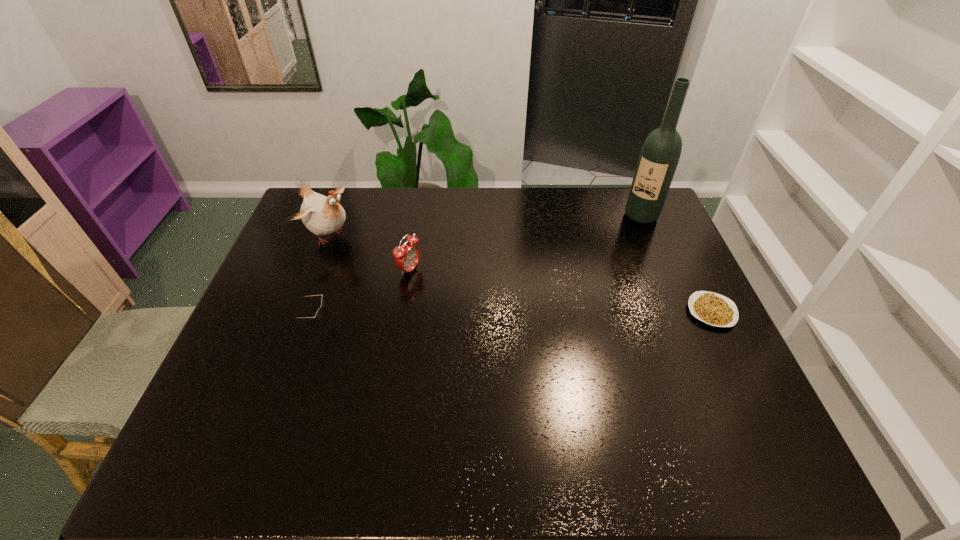
Find the location of `free space between the tallest object and the bird`. free space between the tallest object and the bird is located at coordinates (486, 226).

Find the location of a particular element. The height and width of the screenshot is (540, 960). vacant area that lies between the fourth shortest object and the shortest object is located at coordinates (520, 273).

Where is `blank region between the second shortest object and the legume`? Image resolution: width=960 pixels, height=540 pixels. blank region between the second shortest object and the legume is located at coordinates (513, 318).

Where is `unoccupied position between the alarm clock and the shortest object`? unoccupied position between the alarm clock and the shortest object is located at coordinates (561, 291).

In order to click on free space between the bird and the wine bottle in this screenshot , I will do `click(486, 226)`.

This screenshot has width=960, height=540. In order to click on free point between the shortest object and the bird in this screenshot , I will do `click(520, 273)`.

The height and width of the screenshot is (540, 960). I want to click on free space between the third tallest object and the second shortest object, so click(x=362, y=297).

Where is `empty space that is in between the second tallest object and the third tallest object`? This screenshot has height=540, width=960. empty space that is in between the second tallest object and the third tallest object is located at coordinates click(x=370, y=253).

Select which object is the closest to the alarm clock. Please provide its 2D coordinates. Your answer should be formatted as a tuple, i.e. [(x, y)], where the tuple contains the x and y coordinates of a point satisfying the conditions above.

[(322, 215)]

Select which object appears as the second closest to the fourth shortest object. Please provide its 2D coordinates. Your answer should be formatted as a tuple, i.e. [(x, y)], where the tuple contains the x and y coordinates of a point satisfying the conditions above.

[(318, 314)]